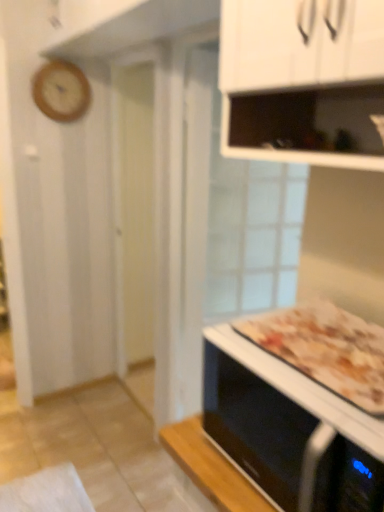
Question: Considering the positions of point (64, 116) and point (291, 358), is point (64, 116) closer or farther from the camera than point (291, 358)?

Choices:
 (A) farther
 (B) closer

Answer: (A)

Question: Visually, is wooden clock at upper left positioned to the left or to the right of golden brown crusty pizza at lower right?

Choices:
 (A) left
 (B) right

Answer: (A)

Question: Which is farther from the black glossy microwave oven at lower right?

Choices:
 (A) wooden clock at upper left
 (B) golden brown crusty pizza at lower right

Answer: (A)

Question: Based on their relative distances, which object is nearer to the wooden clock at upper left?

Choices:
 (A) golden brown crusty pizza at lower right
 (B) black glossy microwave oven at lower right

Answer: (A)